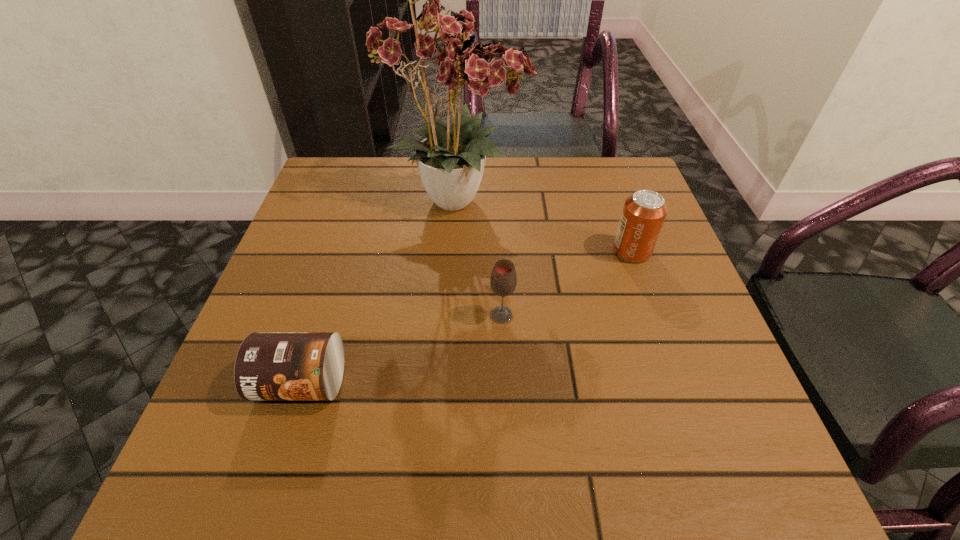
Locate which object is the second closest to the left can. Please provide its 2D coordinates. Your answer should be formatted as a tuple, i.e. [(x, y)], where the tuple contains the x and y coordinates of a point satisfying the conditions above.

[(443, 50)]

Identify which object is the closest to the flower arrangement. Please provide its 2D coordinates. Your answer should be formatted as a tuple, i.e. [(x, y)], where the tuple contains the x and y coordinates of a point satisfying the conditions above.

[(644, 212)]

The image size is (960, 540). Find the location of `free region that satisfies the following two spatial constraints: 1. on the front-facing side of the tallest object; 2. on the back side of the taller can`. free region that satisfies the following two spatial constraints: 1. on the front-facing side of the tallest object; 2. on the back side of the taller can is located at coordinates [x=456, y=251].

Where is `vacant area that satisfies the following two spatial constraints: 1. on the back side of the farther can; 2. on the right side of the second nearest object`? vacant area that satisfies the following two spatial constraints: 1. on the back side of the farther can; 2. on the right side of the second nearest object is located at coordinates (499, 251).

Where is `free space in the image that satisfies the following two spatial constraints: 1. on the front-facing side of the second nearest object; 2. on the left side of the farthest object`? free space in the image that satisfies the following two spatial constraints: 1. on the front-facing side of the second nearest object; 2. on the left side of the farthest object is located at coordinates (452, 315).

The image size is (960, 540). Find the location of `free space that satisfies the following two spatial constraints: 1. on the back side of the second nearest object; 2. on the front-facing side of the flower arrangement`. free space that satisfies the following two spatial constraints: 1. on the back side of the second nearest object; 2. on the front-facing side of the flower arrangement is located at coordinates (496, 199).

This screenshot has height=540, width=960. What are the coordinates of `free location that satisfies the following two spatial constraints: 1. on the front-facing side of the tallest object; 2. on the right side of the taller can` in the screenshot? It's located at (456, 251).

Where is `free location that satisfies the following two spatial constraints: 1. on the front-facing side of the farthest object; 2. on the front label of the shorter can`? The height and width of the screenshot is (540, 960). free location that satisfies the following two spatial constraints: 1. on the front-facing side of the farthest object; 2. on the front label of the shorter can is located at coordinates (448, 383).

Identify the location of vacant space that satisfies the following two spatial constraints: 1. on the front-facing side of the farthest object; 2. on the right side of the third nearest object. The width and height of the screenshot is (960, 540). (456, 251).